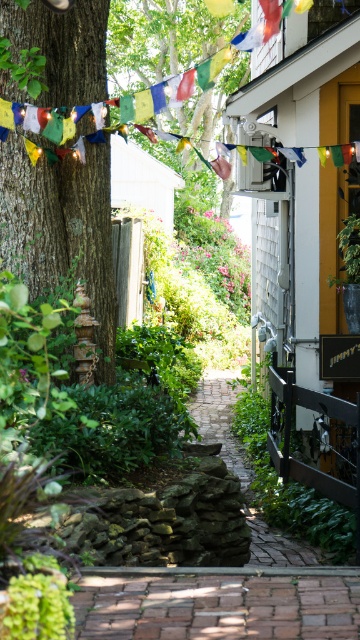
Who is more distant from viewer, (51, 221) or (281, 564)?

The point (51, 221) is behind.

Describe the element at coordinates (61, 230) in the screenshot. I see `green rough bark tree at left` at that location.

Is point (91, 122) less distant than point (262, 556)?

No, it is not.

The height and width of the screenshot is (640, 360). I want to click on green rough bark tree at left, so click(61, 230).

In the scene shown: Which is above, green leafy tree at upper center or brick paved path at center?

Positioned higher is green leafy tree at upper center.

Which is behind, point (173, 52) or point (270, 548)?

The point (173, 52) is more distant.

In order to click on green leafy tree at upper center in this screenshot , I will do `click(164, 38)`.

Who is lower down, green rough bark tree at left or green leafy tree at upper center?

green rough bark tree at left is below.

Is green rough bark tree at left to the right of green leafy tree at upper center from the viewer's perspective?

In fact, green rough bark tree at left is to the left of green leafy tree at upper center.

You are a GUI agent. You are given a task and a screenshot of the screen. Output one action in this format:
    pyautogui.click(x=<x>, y=<y>)
    Task: Click on the green rough bark tree at left
    This screenshot has width=360, height=640.
    Given the screenshot: What is the action you would take?
    pyautogui.click(x=61, y=230)